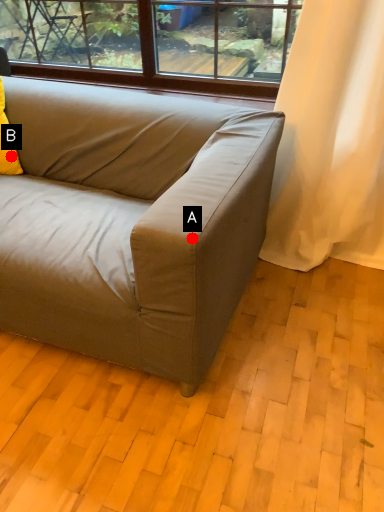
Question: Two points are circled on the image, labeled by A and B beside each circle. Among these points, which one is nearest to the camera?

Choices:
 (A) A is closer
 (B) B is closer

Answer: (A)